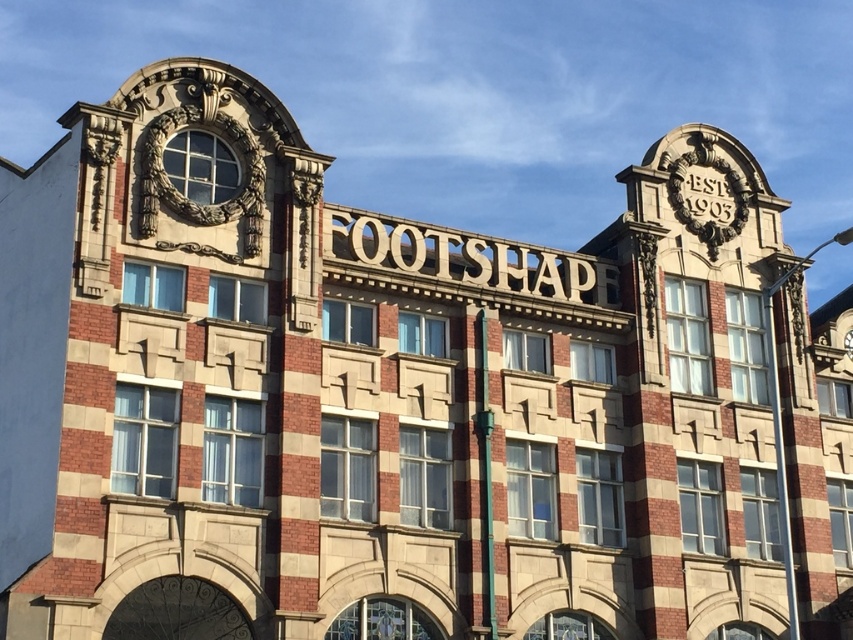
You are a window cleaner standing on a platform that can only hold items up to 1 meter wide. You need to clean both the gold metallic clock at upper right and the gold metallic clock at upper center. Which clock should you clean first to ensure the platform can support you?

You should clean the gold metallic clock at upper center first because its width is smaller than the gold metallic clock at upper right, ensuring the platform can safely support you while cleaning.